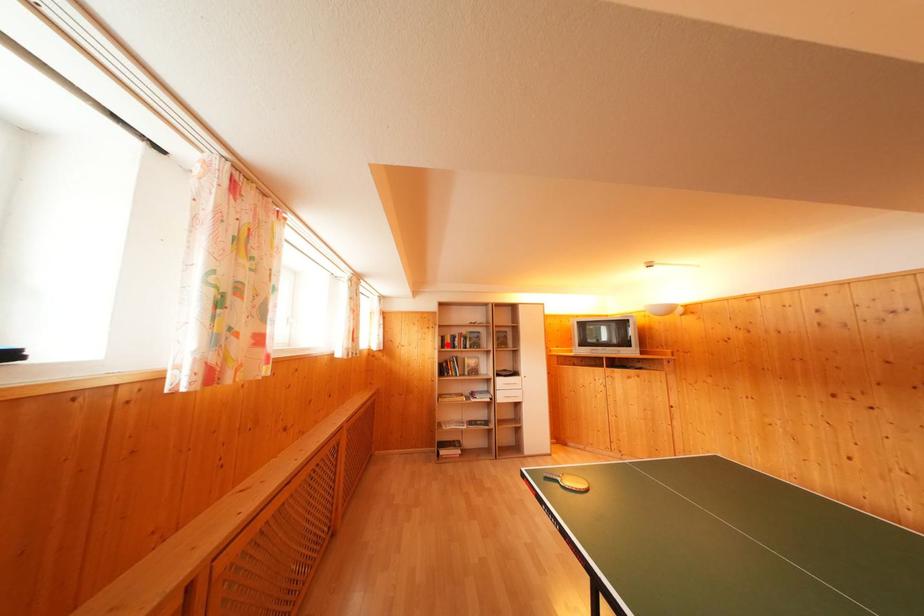
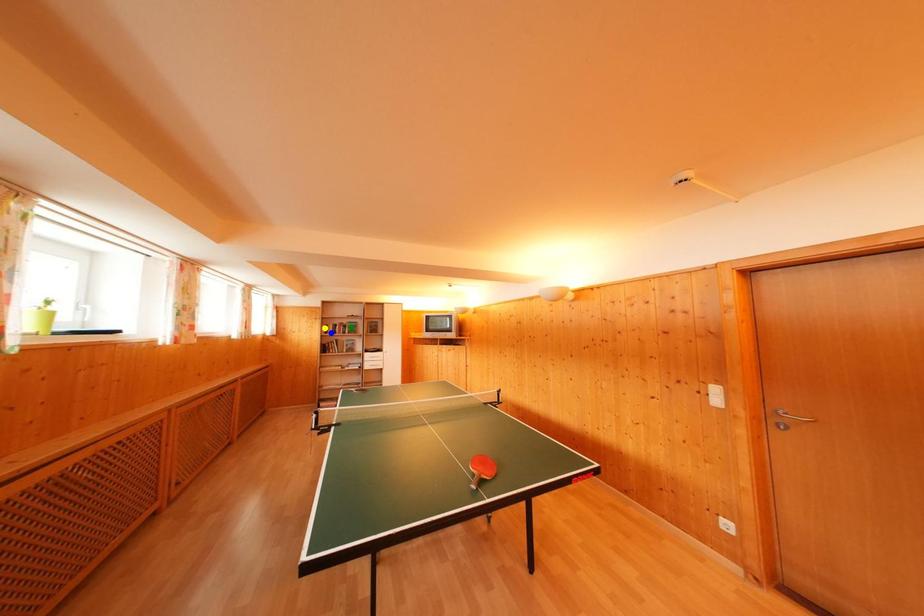
Question: I am providing you with two images of the same scene from different viewpoints. A red point is marked on the first image. You are given multiple points on the second image. Which mark in image 2 goes with the point in image 1?

Choices:
 (A) green point
 (B) yellow point
 (C) blue point

Answer: (C)